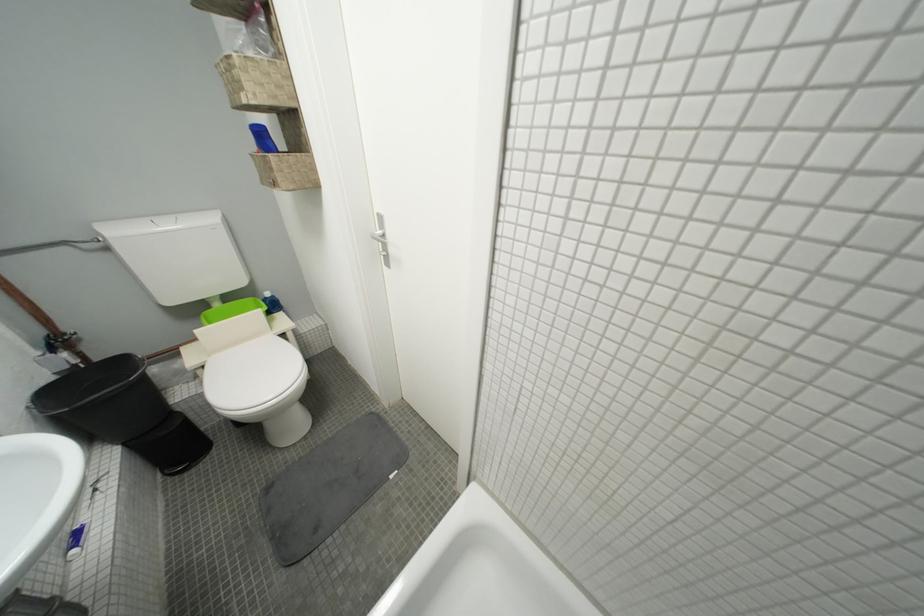
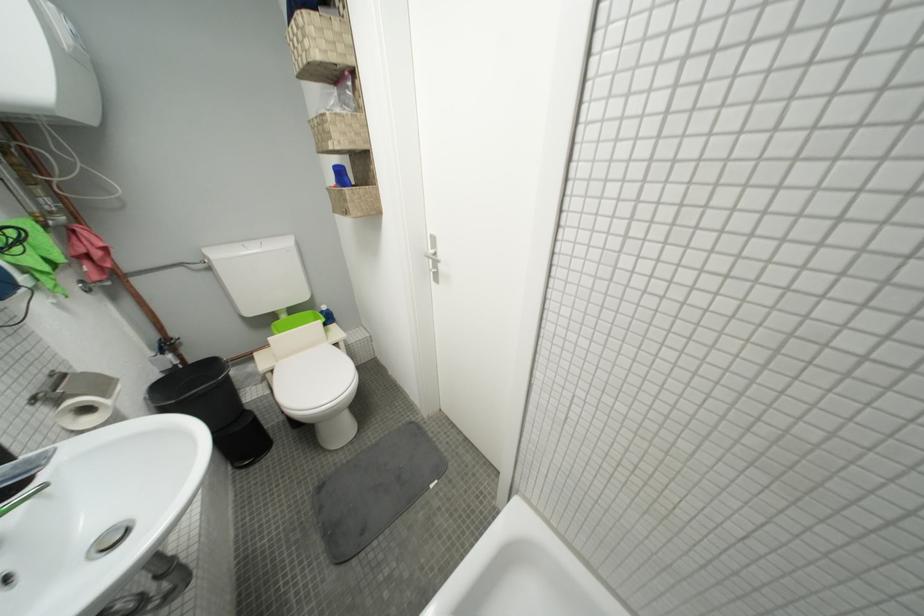
Locate, in the second image, the point that corresponds to point (68, 345) in the first image.

(175, 347)